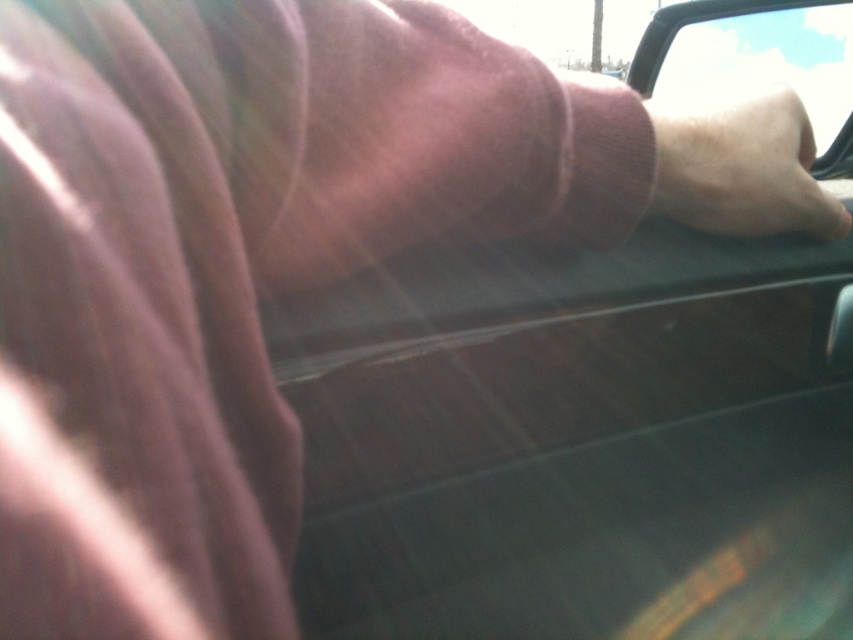
You are a passenger in a car and want to know if you can fully open your phone to take a photo of the scenery outside. Considering the space between the skinny white hand at upper right and the black plastic car window at upper right, will there be enough room?

The skinny white hand at upper right occupies less space than the black plastic car window at upper right, so there should be enough space to open the phone partially, but the exact amount of space available isn

Based on the photo, you are a passenger in a car and want to see the road ahead. There is a skinny white hand at upper right and a black plastic car window at upper right. Which object is closer to you?

Result: The skinny white hand at upper right is closer to you because it is in front of the black plastic car window at upper right.

You are a passenger in a car and want to roll down the black plastic car window at upper right. To do so, you need to reach the window control button, which is located on the left side of the window. Can you reach it with your skinny white hand at upper right?

The skinny white hand at upper right is positioned on the left side of the black plastic car window at upper right, so yes, the hand can reach the window control button on the left side of the window.